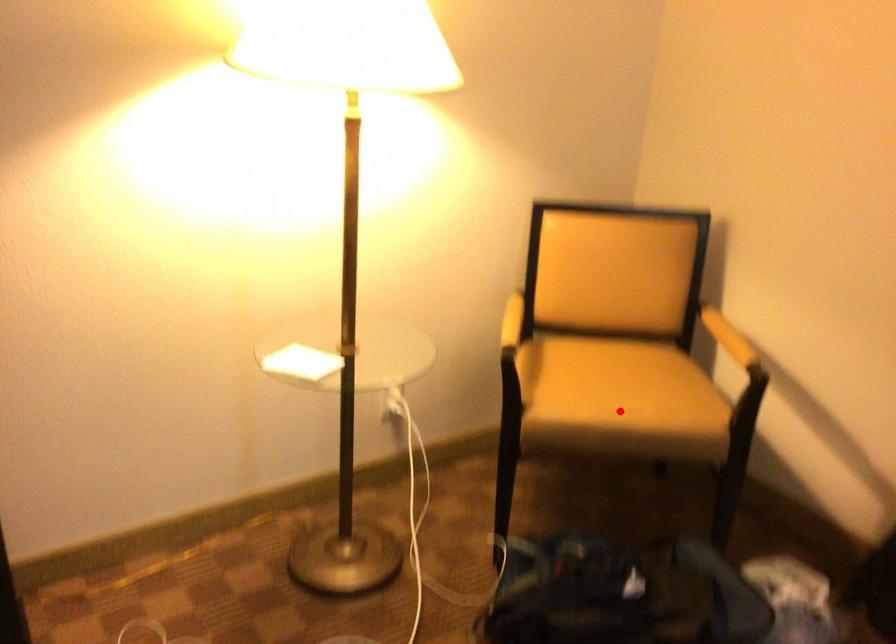
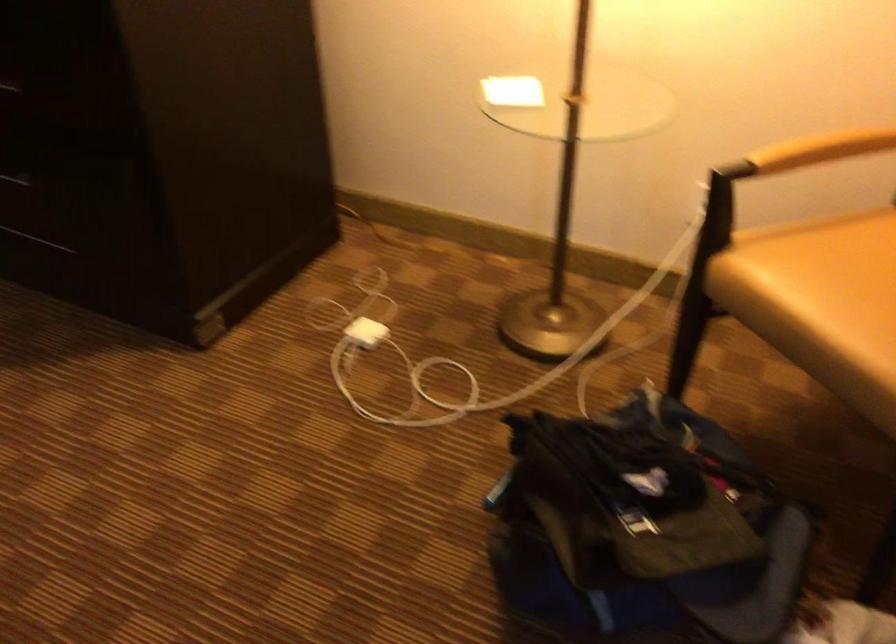
Question: I am providing you with two images of the same scene from different viewpoints. In image1, a red point is highlighted. Considering the same 3D point in image2, which of the following is correct?

Choices:
 (A) It is closer
 (B) It is farther

Answer: (A)